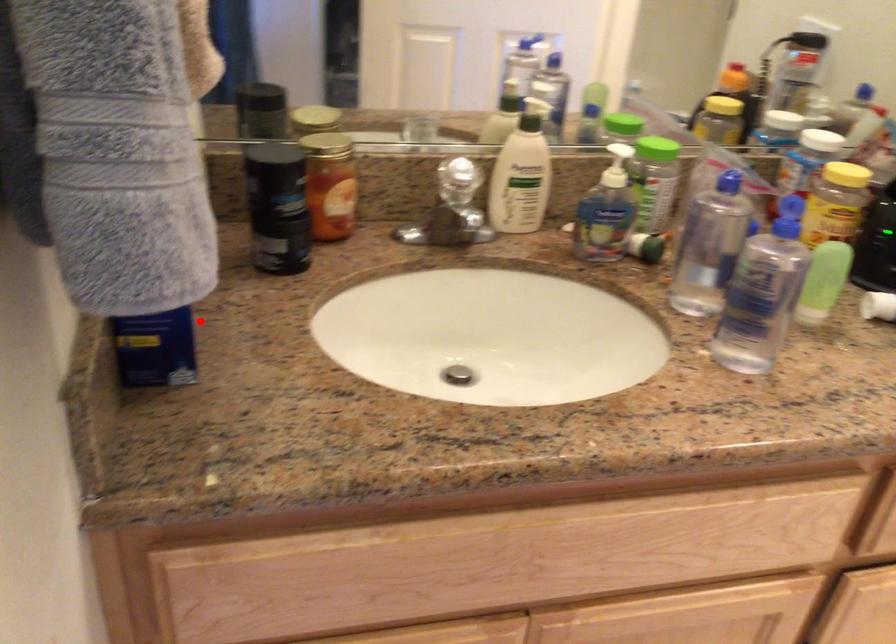
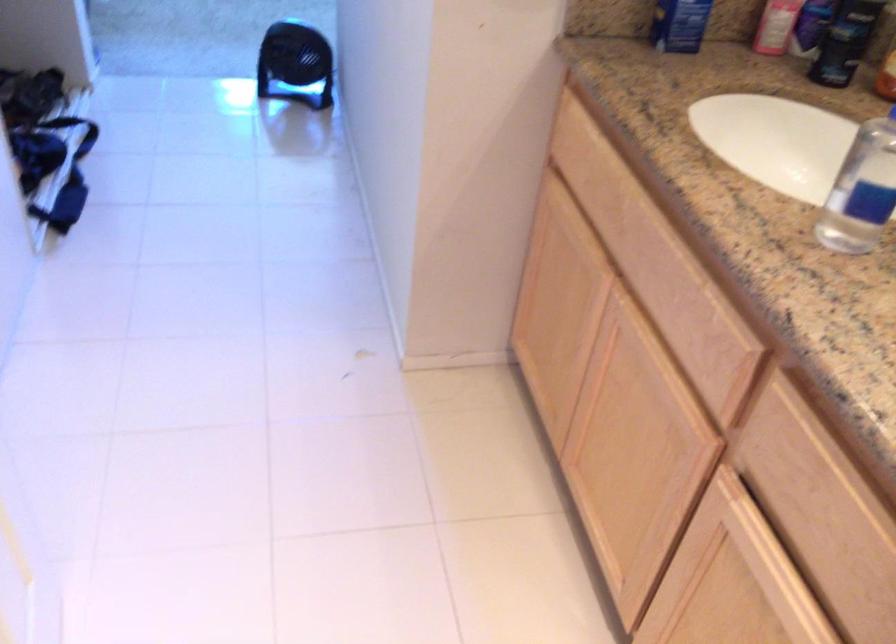
Question: I am providing you with two images of the same scene from different viewpoints. Image1 has a red point marked. In image2, the corresponding 3D location appears at what relative position? Reply with the corresponding letter.

Choices:
 (A) Closer
 (B) Farther

Answer: (B)